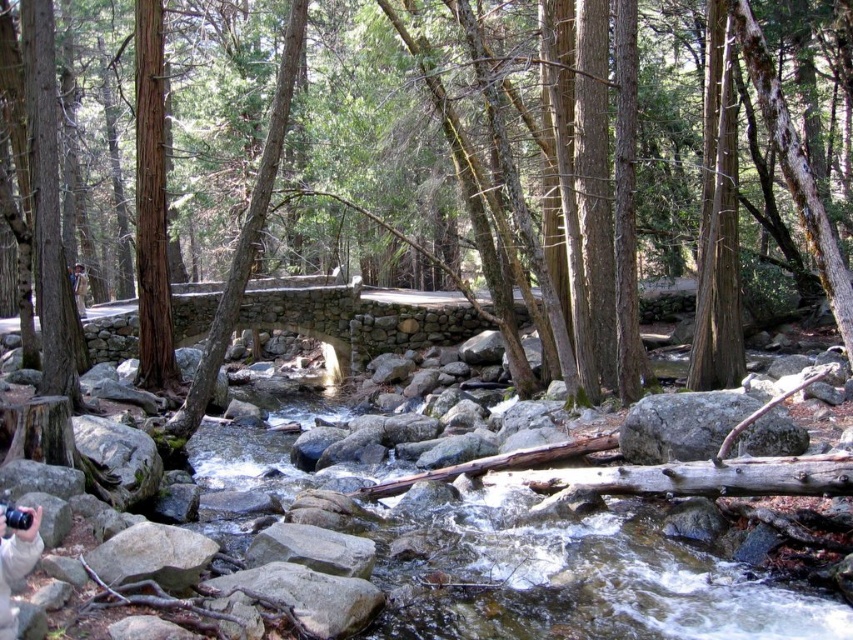
You are a hiker trying to cross the stream using the rocks. You see the green mossy rocks at center and the smooth gray rock at center. Which rock should you step on first to start your crossing?

You should step on the smooth gray rock at center first because it is lower than the green mossy rocks at center, making it easier to reach from the starting point.

You are standing at the point with coordinates point (157,305) and want to cross the stream to reach the point with coordinates point (685,413). Given the presence of the rustic stone bridge in the scene, can you safely cross the stream using the bridge?

Yes, you can safely cross the stream using the rustic stone bridge because the bridge spans the stream and connects both sides, allowing safe passage from point (157,305) to point (685,413).

You are a hiker trying to cross the stream using the rocks. You see the green mossy rocks at center and the smooth gray rock at center. Which rock is located to the left when facing upstream?

The green mossy rocks at center is positioned on the left side of smooth gray rock at center, so when facing upstream, the green mossy rocks at center would be to the left of the smooth gray rock at center.